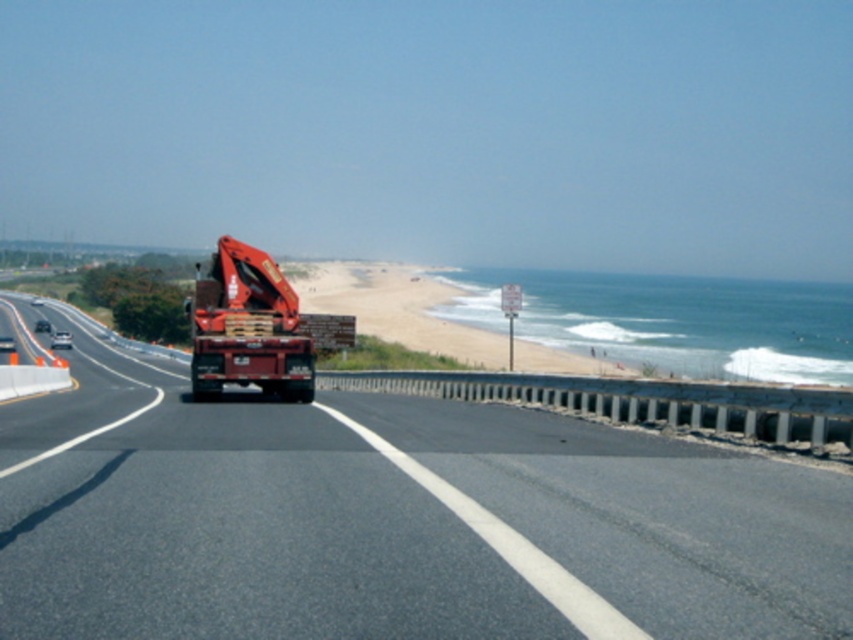
Question: Can you confirm if smooth asphalt highway at center is positioned below matte red trailer truck at center?

Choices:
 (A) no
 (B) yes

Answer: (B)

Question: Which of the following is the closest to the observer?

Choices:
 (A) (585, 557)
 (B) (288, 358)

Answer: (A)

Question: Where is smooth asphalt highway at center located in relation to matte red trailer truck at center in the image?

Choices:
 (A) right
 (B) left

Answer: (A)

Question: Which point appears farthest from the camera in this image?

Choices:
 (A) (236, 483)
 (B) (262, 278)

Answer: (B)

Question: Where is smooth asphalt highway at center located in relation to matte red trailer truck at center in the image?

Choices:
 (A) below
 (B) above

Answer: (A)